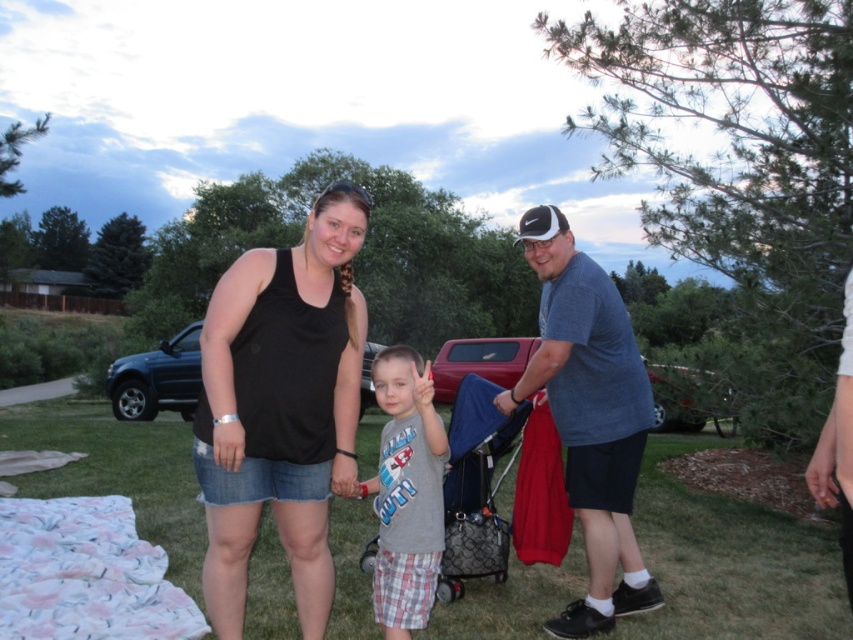
Question: Does blue cotton shirt at center come in front of blue fabric stroller at center?

Choices:
 (A) yes
 (B) no

Answer: (A)

Question: Is black matte tank top at center closer to the viewer compared to gray cotton shirt at center?

Choices:
 (A) yes
 (B) no

Answer: (B)

Question: Which point is farther to the camera?

Choices:
 (A) fluffy cotton blanket at lower left
 (B) blue cotton shirt at center
 (C) gray cotton shirt at center

Answer: (B)

Question: Which object is farther from the camera taking this photo?

Choices:
 (A) fluffy cotton blanket at lower left
 (B) blue fabric stroller at center
 (C) black matte tank top at center
 (D) black cotton tank top at center

Answer: (B)

Question: Which point is farther to the camera?

Choices:
 (A) (488, 541)
 (B) (374, 499)
 (C) (209, 317)
 (D) (299, 458)

Answer: (B)

Question: Is gray cotton shirt at center to the right of blue fabric stroller at center from the viewer's perspective?

Choices:
 (A) no
 (B) yes

Answer: (A)